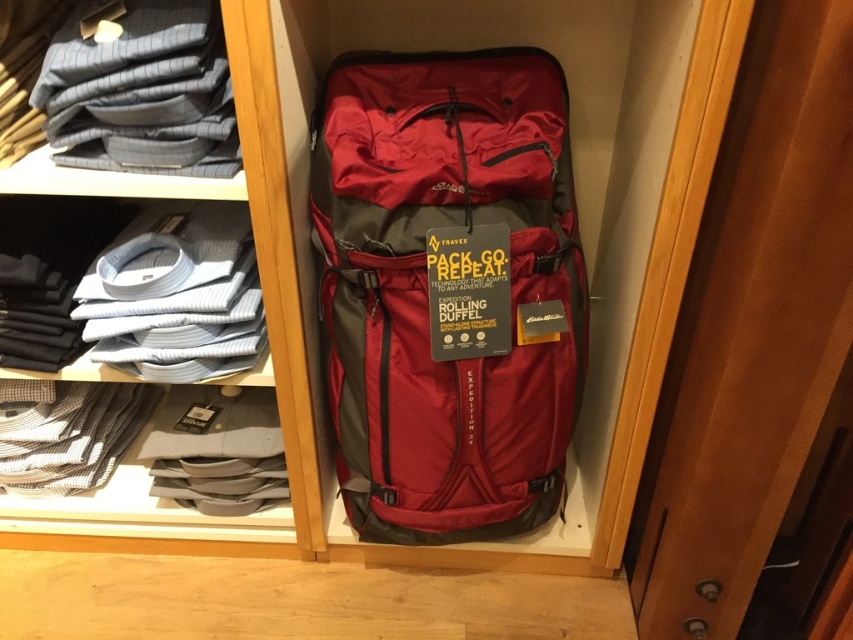
Question: Which of the following is the farthest from the observer?

Choices:
 (A) (422, 193)
 (B) (183, 193)

Answer: (B)

Question: Which object is positioned farthest from the matte red duffel bag at center?

Choices:
 (A) gray striped shirt at upper left
 (B) matte gray shirts at left

Answer: (A)

Question: Does matte gray shirts at left appear over gray striped shirt at upper left?

Choices:
 (A) yes
 (B) no

Answer: (B)

Question: Can you confirm if matte red duffel bag at center is wider than gray striped shirt at upper left?

Choices:
 (A) no
 (B) yes

Answer: (B)

Question: Which point appears farthest from the camera in this image?

Choices:
 (A) click(70, 193)
 (B) click(192, 35)
 (C) click(578, 344)

Answer: (C)

Question: Can you confirm if matte red duffel bag at center is positioned to the left of matte gray shirts at left?

Choices:
 (A) yes
 (B) no

Answer: (B)